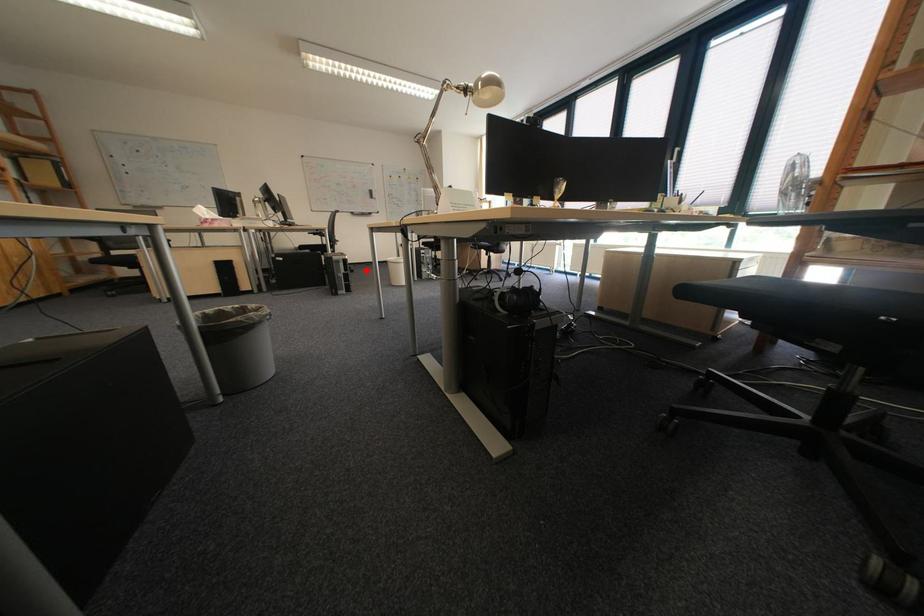
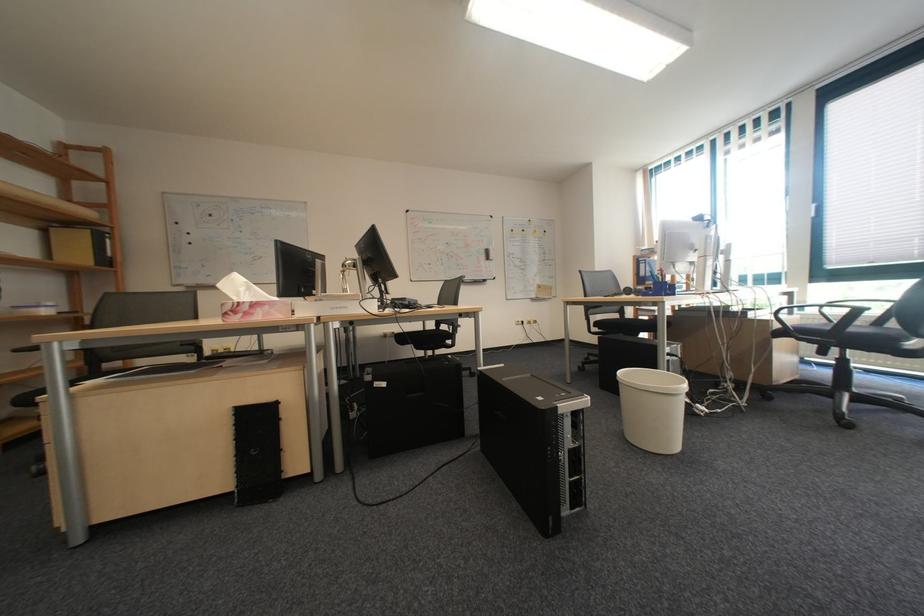
Question: I am providing you with two images of the same scene from different viewpoints. In image1, a red point is highlighted. Considering the same 3D point in image2, which of the following is correct?

Choices:
 (A) It is closer
 (B) It is farther

Answer: (A)